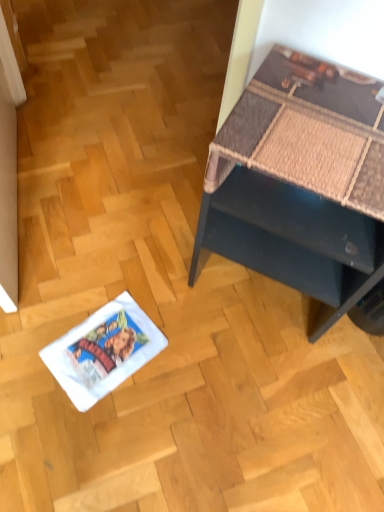
Image resolution: width=384 pixels, height=512 pixels. What are the coordinates of `empty space that is ontop of white paper comic book at lower left (from a real-world perspective)` in the screenshot? It's located at tap(100, 340).